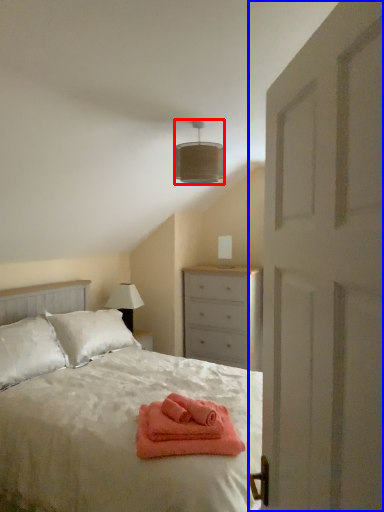
Question: Which point is further to the camera, lamp (highlighted by a red box) or door (highlighted by a blue box)?

Choices:
 (A) lamp
 (B) door

Answer: (A)